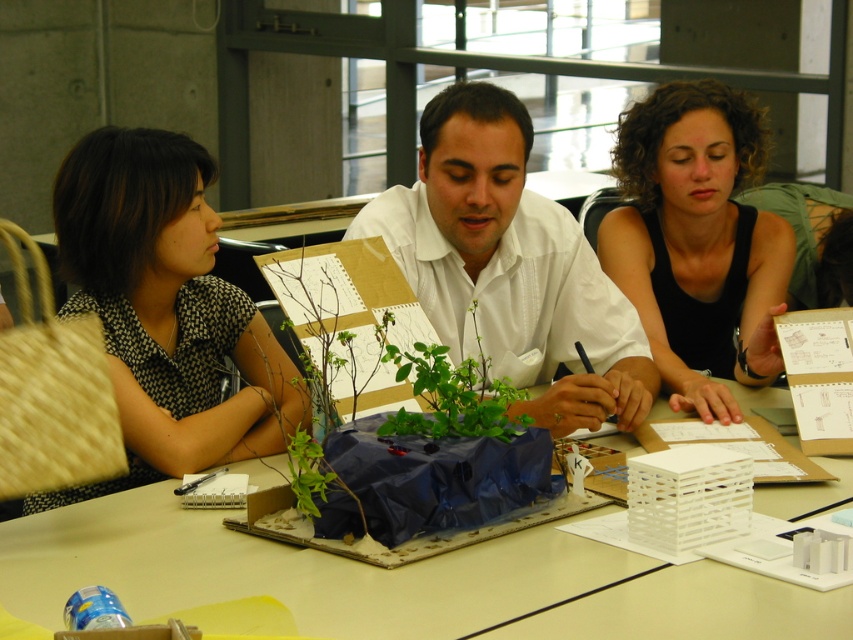
You are a photographer standing at the side of the table. You need to take a photo of the green leafy plant at center without the black matte tank top at upper right appearing in the frame. Is this possible based on their positions?

The black matte tank top at upper right is above the green leafy plant at center, so it would block the view. To capture the plant without the tank top, you would need to adjust your angle or position to avoid the tank top being in front of the plant.

Which object is smaller in size between the blue plastic bag at center and the white matte shirt at center?

The blue plastic bag at center is smaller in size compared to the white matte shirt at center.

You are standing in front of the table with the model and the cardboard base. There are two points marked on the table surface. One is at coordinate point (752, 369) and the other is at point (459, 378). Which point is closer to you?

Point (752, 369) is closer to you because it is further to the camera than point (459, 378).